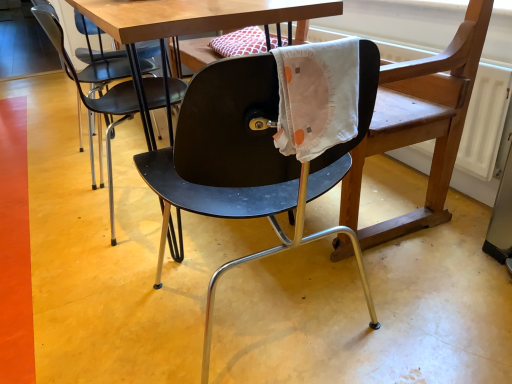
This screenshot has height=384, width=512. I want to click on vacant space underneath matte black chair at center, acting as the second chair starting from the right (from a real-world perspective), so click(134, 201).